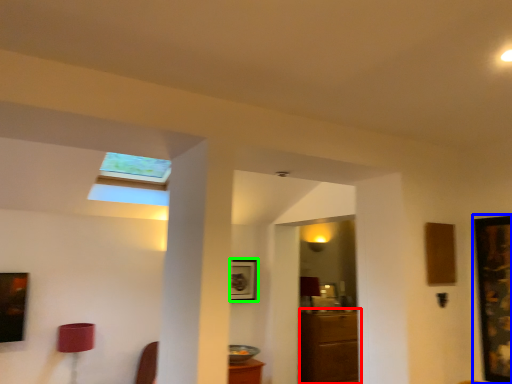
Question: Considering the real-world distances, which object is closest to furniture (highlighted by a red box)? picture frame (highlighted by a blue box) or picture frame (highlighted by a green box).

Choices:
 (A) picture frame
 (B) picture frame

Answer: (B)